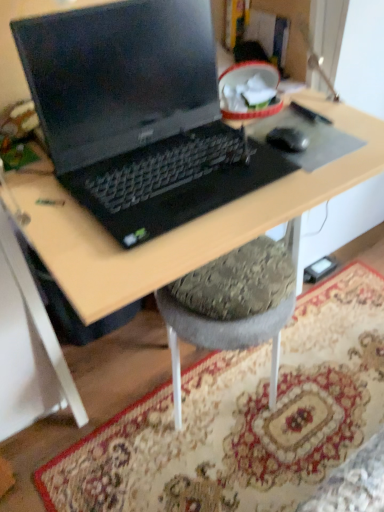
Question: From the image's perspective, is black rubber mouse at right positioned above or below black matte mousepad at center?

Choices:
 (A) above
 (B) below

Answer: (B)

Question: Is black rubber mouse at right in front of or behind black matte mousepad at center in the image?

Choices:
 (A) behind
 (B) front

Answer: (A)

Question: Which of these objects is positioned farthest from the black plastic desk at center?

Choices:
 (A) black rubber mouse at right
 (B) black matte laptop at center
 (C) carpeted rug at lower center
 (D) black matte mousepad at center

Answer: (C)

Question: Considering the real-world distances, which object is closest to the black matte laptop at center?

Choices:
 (A) carpeted rug at lower center
 (B) black matte mousepad at center
 (C) black rubber mouse at right
 (D) black plastic desk at center

Answer: (D)